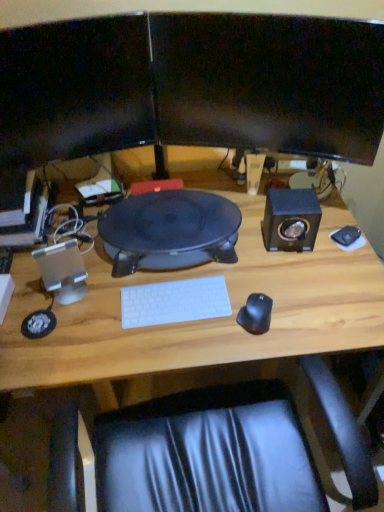
Image resolution: width=384 pixels, height=512 pixels. Identify the location of empty space that is ontop of matte black speaker at center. (168, 217).